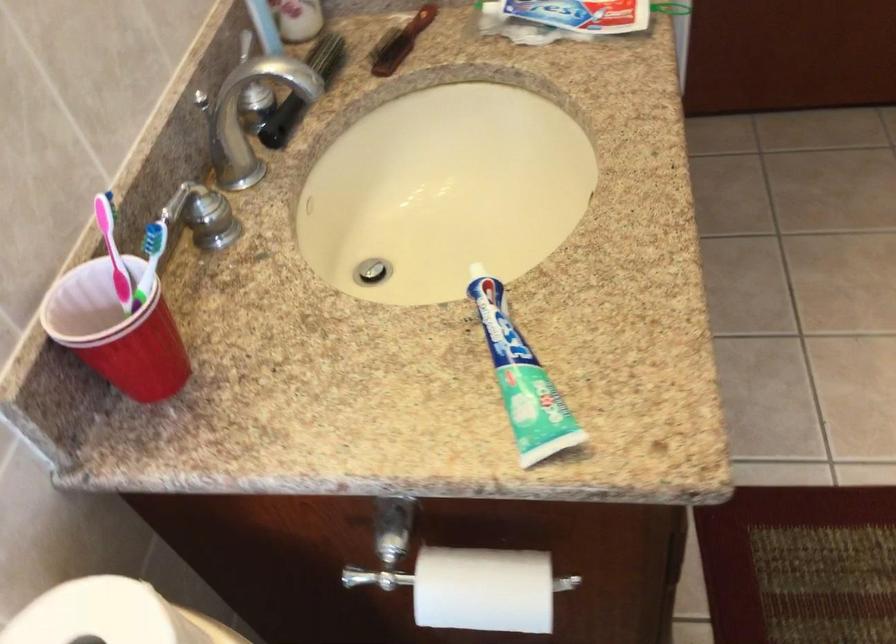
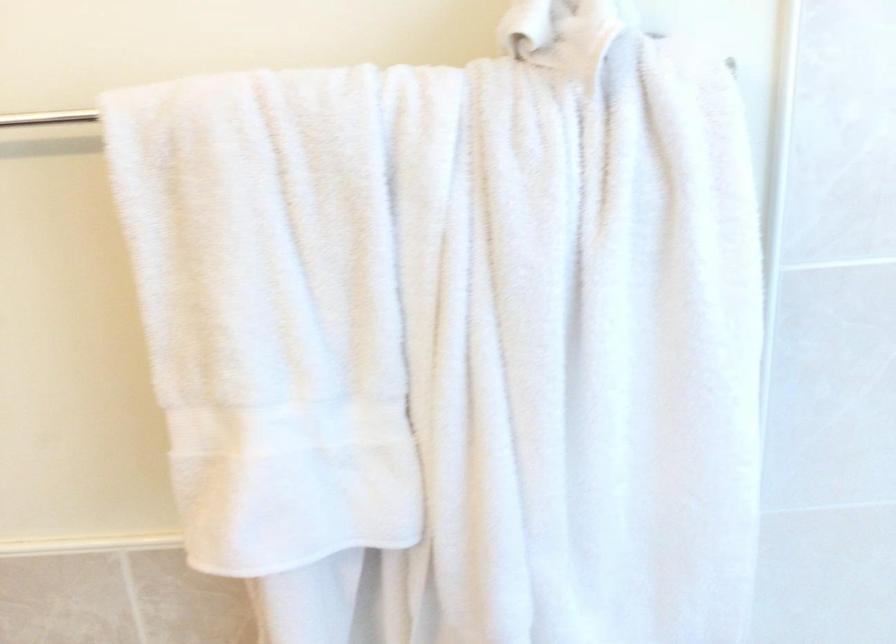
Question: How did the camera likely rotate?

Choices:
 (A) Left
 (B) Right
 (C) Up
 (D) Down

Answer: (B)